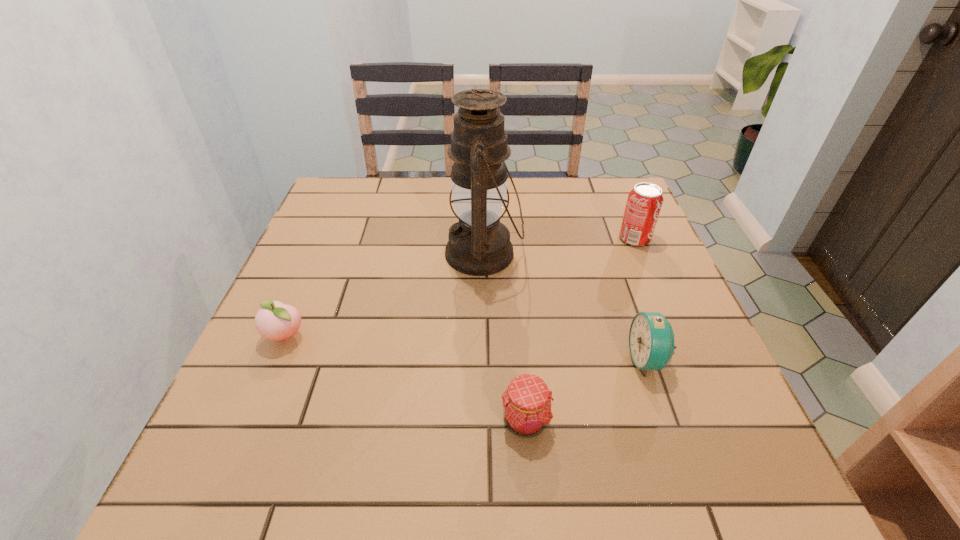
Identify the location of empty space that is in between the jam and the leftmost object. (405, 379).

I want to click on vacant area between the alarm clock and the peach, so click(467, 348).

The height and width of the screenshot is (540, 960). What are the coordinates of `empty space that is in between the tallest object and the third tallest object` in the screenshot? It's located at (565, 307).

This screenshot has height=540, width=960. In order to click on the closest object relative to the soda can in this screenshot , I will do `click(479, 244)`.

Where is `the fourth closest object relative to the third tallest object`? The width and height of the screenshot is (960, 540). the fourth closest object relative to the third tallest object is located at coordinates (276, 321).

The image size is (960, 540). What are the coordinates of `vacant point that satisfies the following two spatial constraints: 1. on the back side of the peach; 2. on the left side of the soda can` in the screenshot? It's located at (327, 239).